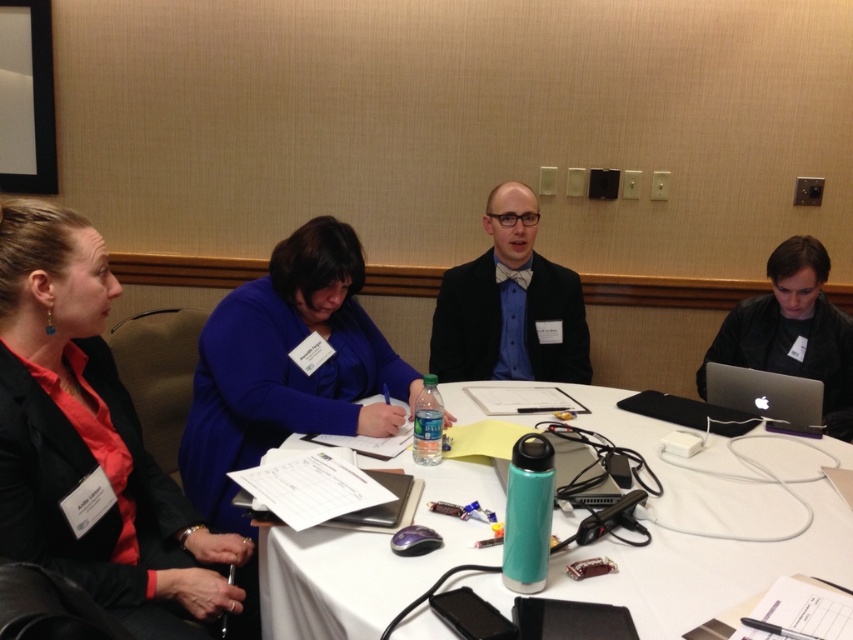
Question: Which point is closer to the camera?

Choices:
 (A) matte black bow tie at center
 (B) matte black blazer at left
 (C) blue fabric dress at center

Answer: (B)

Question: Does blue fabric dress at center appear on the right side of silver metallic laptop at lower right?

Choices:
 (A) yes
 (B) no

Answer: (B)

Question: Is matte black blazer at left to the right of blue fabric dress at center from the viewer's perspective?

Choices:
 (A) yes
 (B) no

Answer: (B)

Question: Which object is closer to the camera taking this photo?

Choices:
 (A) silver metallic laptop at lower right
 (B) matte black bow tie at center
 (C) matte black blazer at left

Answer: (C)

Question: Which is nearer to the black matte laptop at right?

Choices:
 (A) blue fabric dress at center
 (B) teal plastic water bottle at center
 (C) matte black blazer at left

Answer: (B)

Question: Is teal plastic water bottle at center to the right of matte black blazer at left from the viewer's perspective?

Choices:
 (A) yes
 (B) no

Answer: (A)